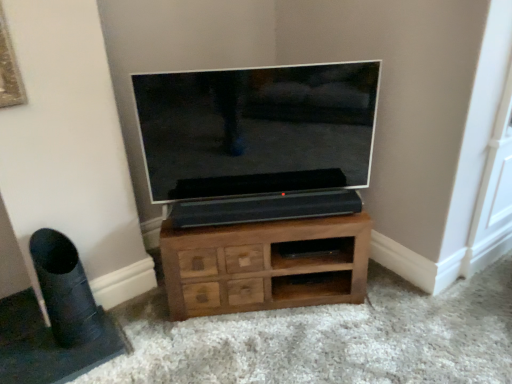
The width and height of the screenshot is (512, 384). Identify the location of free spot in front of brown wood chest of drawers at center. (272, 349).